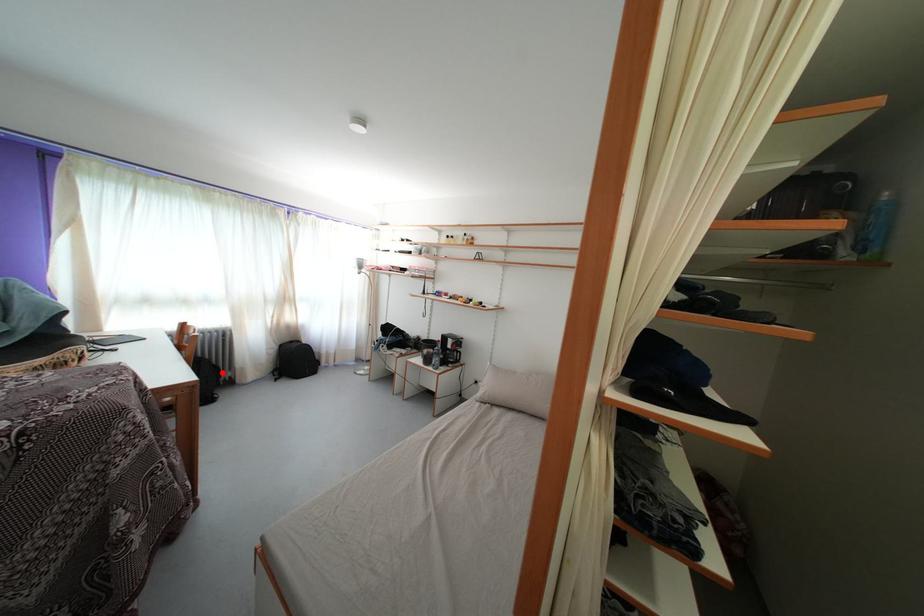
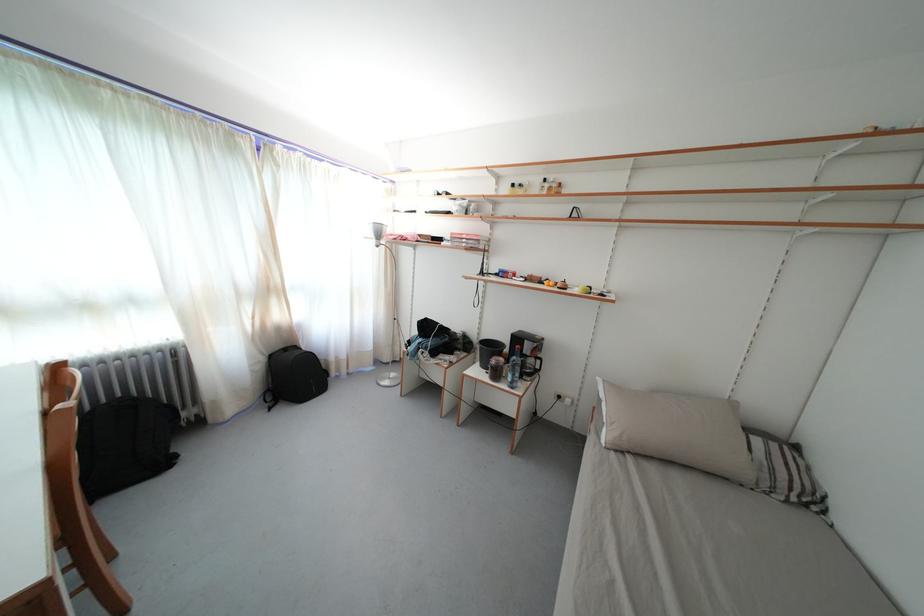
Where in the second image is the point corresponding to the highlighted location from the first image?

(175, 411)